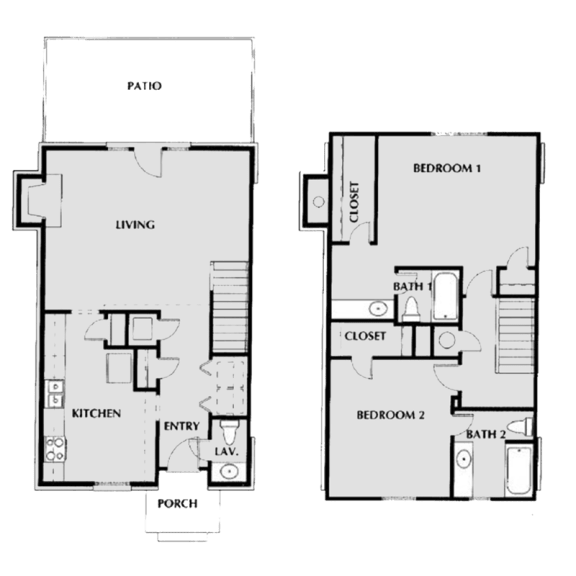
Where is `stove`? stove is located at coordinates (52, 450).